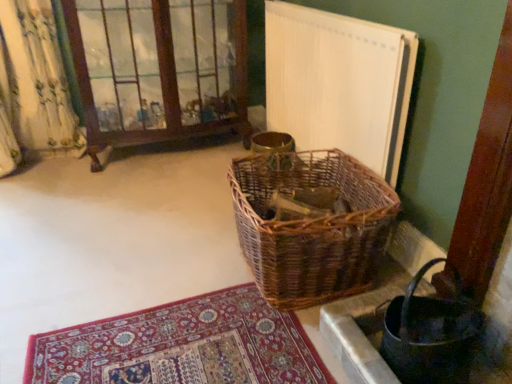
What do you see at coordinates (430, 334) in the screenshot? I see `woven brown basket at lower right` at bounding box center [430, 334].

In order to face woven brown basket at lower right, should I rotate leftwards or rightwards?

It's best to rotate right around 22.062 degrees.

The image size is (512, 384). What do you see at coordinates (158, 69) in the screenshot?
I see `brown wooden window frame at upper left` at bounding box center [158, 69].

Where is `white textured radiator at upper right`? The image size is (512, 384). white textured radiator at upper right is located at coordinates (339, 83).

Looking at this image, considering the sizes of objects brown wooden window frame at upper left and woven brown picnic basket at center in the image provided, who is smaller, brown wooden window frame at upper left or woven brown picnic basket at center?

woven brown picnic basket at center is smaller.

Considering the relative sizes of brown wooden window frame at upper left and woven brown picnic basket at center in the image provided, is brown wooden window frame at upper left shorter than woven brown picnic basket at center?

No.

From the image's perspective, is brown wooden window frame at upper left over woven brown picnic basket at center?

Correct, brown wooden window frame at upper left appears higher than woven brown picnic basket at center in the image.

Is brown wooden window frame at upper left wider or thinner than woven brown picnic basket at center?

brown wooden window frame at upper left is thinner than woven brown picnic basket at center.

Is white textured radiator at upper right bigger or smaller than woven brown basket at lower right?

Clearly, white textured radiator at upper right is larger in size than woven brown basket at lower right.

What's the angular difference between white textured radiator at upper right and woven brown basket at lower right's facing directions?

The angular difference between white textured radiator at upper right and woven brown basket at lower right is 1.1 degrees.

From the image's perspective, is white textured radiator at upper right on woven brown basket at lower right?

Yes, from the image's perspective, white textured radiator at upper right is over woven brown basket at lower right.

Is white textured radiator at upper right to the left of woven brown basket at lower right from the viewer's perspective?

Yes, white textured radiator at upper right is to the left of woven brown basket at lower right.

Can we say woven brown basket at lower right lies outside woven brown picnic basket at center?

That's correct, woven brown basket at lower right is outside of woven brown picnic basket at center.

From a real-world perspective, which is physically below, woven brown basket at lower right or woven brown picnic basket at center?

woven brown basket at lower right.

Does point (426, 263) appear closer or farther from the camera than point (389, 230)?

Point (426, 263).

How different are the orientations of woven brown basket at lower right and woven brown picnic basket at center in degrees?

They differ by 2.5 degrees in their facing directions.

Based on their positions, is woven brown picnic basket at center located to the left or right of white textured radiator at upper right?

From the image, it's evident that woven brown picnic basket at center is to the left of white textured radiator at upper right.

Based on the photo, from a real-world perspective, is woven brown picnic basket at center positioned above or below white textured radiator at upper right?

From a real-world perspective, woven brown picnic basket at center is physically below white textured radiator at upper right.

What's the angular difference between woven brown picnic basket at center and white textured radiator at upper right's facing directions?

3.6 degrees separate the facing orientations of woven brown picnic basket at center and white textured radiator at upper right.

Is woven brown picnic basket at center closer to camera compared to white textured radiator at upper right?

Yes, woven brown picnic basket at center is closer to the camera.

Based on the photo, is woven brown basket at lower right closer to the viewer compared to white textured radiator at upper right?

Yes, the depth of woven brown basket at lower right is less than that of white textured radiator at upper right.

Does point (444, 377) come farther from viewer compared to point (351, 120)?

No, (444, 377) is closer to viewer.

Considering the relative sizes of woven brown basket at lower right and white textured radiator at upper right in the image provided, is woven brown basket at lower right smaller than white textured radiator at upper right?

Yes.

Can you tell me how much woven brown basket at lower right and white textured radiator at upper right differ in facing direction?

The facing directions of woven brown basket at lower right and white textured radiator at upper right are 1.1 degrees apart.

From the image's perspective, is woven brown basket at lower right above brown wooden window frame at upper left?

No, from the image's perspective, woven brown basket at lower right is not on top of brown wooden window frame at upper left.

Is woven brown basket at lower right inside the boundaries of brown wooden window frame at upper left, or outside?

woven brown basket at lower right is located beyond the bounds of brown wooden window frame at upper left.

Is point (252, 262) more distant than point (93, 53)?

No, it is not.

Is woven brown picnic basket at center not near brown wooden window frame at upper left?

Yes.

Considering the positions of objects woven brown picnic basket at center and brown wooden window frame at upper left in the image provided, who is more to the left, woven brown picnic basket at center or brown wooden window frame at upper left?

From the viewer's perspective, brown wooden window frame at upper left appears more on the left side.

From the image's perspective, is woven brown picnic basket at center located beneath brown wooden window frame at upper left?

Yes, from the image's perspective, woven brown picnic basket at center is beneath brown wooden window frame at upper left.

Locate an element on the screen. This screenshot has width=512, height=384. picnic basket that is in front of the brown wooden window frame at upper left is located at coordinates (312, 227).

I want to click on basket on the right of the white textured radiator at upper right, so click(430, 334).

Looking at the image, which one is located further to white textured radiator at upper right, woven brown basket at lower right or brown wooden window frame at upper left?

woven brown basket at lower right is further to white textured radiator at upper right.

Estimate the real-world distances between objects in this image. Which object is closer to brown wooden window frame at upper left, white textured radiator at upper right or woven brown basket at lower right?

Based on the image, white textured radiator at upper right appears to be nearer to brown wooden window frame at upper left.

Considering their positions, is woven brown basket at lower right positioned closer to woven brown picnic basket at center than white textured radiator at upper right?

white textured radiator at upper right is positioned closer to the anchor woven brown picnic basket at center.

Looking at the image, which one is located further to brown wooden window frame at upper left, woven brown picnic basket at center or woven brown basket at lower right?

The object further to brown wooden window frame at upper left is woven brown basket at lower right.

From the image, which object appears to be nearer to brown wooden window frame at upper left, white textured radiator at upper right or woven brown picnic basket at center?

white textured radiator at upper right is closer to brown wooden window frame at upper left.

From the image, which object appears to be nearer to woven brown picnic basket at center, white textured radiator at upper right or woven brown basket at lower right?

Among the two, white textured radiator at upper right is located nearer to woven brown picnic basket at center.

When comparing their distances from brown wooden window frame at upper left, does woven brown picnic basket at center or white textured radiator at upper right seem closer?

Among the two, white textured radiator at upper right is located nearer to brown wooden window frame at upper left.

Looking at the image, which one is located further to woven brown picnic basket at center, brown wooden window frame at upper left or woven brown basket at lower right?

brown wooden window frame at upper left lies further to woven brown picnic basket at center than the other object.

I want to click on picnic basket between brown wooden window frame at upper left and woven brown basket at lower right in the up-down direction, so click(x=312, y=227).

The height and width of the screenshot is (384, 512). I want to click on picnic basket between brown wooden window frame at upper left and white textured radiator at upper right, so click(312, 227).

You are a GUI agent. You are given a task and a screenshot of the screen. Output one action in this format:
    pyautogui.click(x=<x>, y=<y>)
    Task: Click on the radiator located between brown wooden window frame at upper left and woven brown basket at lower right in the left-right direction
    
    Given the screenshot: What is the action you would take?
    (x=339, y=83)

Identify the location of picnic basket between white textured radiator at upper right and woven brown basket at lower right from top to bottom. This screenshot has width=512, height=384. (312, 227).